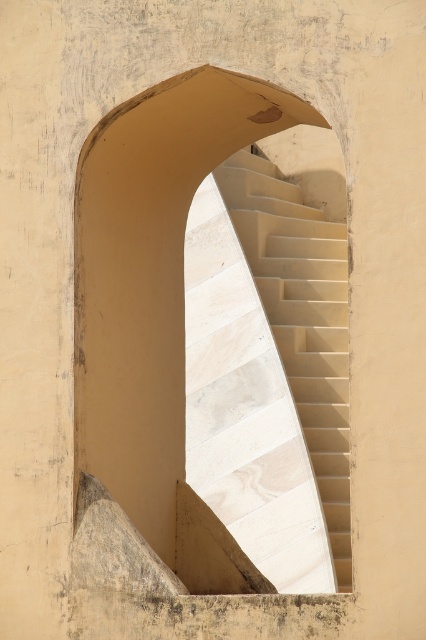
You are an architect designing a new building and want to ensure that the beige marble stairs at center are wider than the beige stone archway at center. Based on the image provided, will this design requirement be met?

The beige stone archway at center is wider than the beige marble stairs at center, so the design requirement for the stairs to be wider will not be met.

You are an architect designing a new building and want to ensure accessibility for wheelchairs. The minimum required distance between the beige stone archway at center and the beige marble stairs at center must be at least 1.5 meters for safety. Based on the image, does the current distance meet this requirement?

The beige stone archway at center is 2.48 meters away from the beige marble stairs at center, which exceeds the 1.5 meter requirement. Therefore, the current distance meets the accessibility requirement for wheelchair safety.

You are an architect designing a new building and want to incorporate a similar spiral staircase within an arched opening. The current design requires the distance between the beige stone archway at center and the nearest support beam to be at least 28 meters. Based on the image, will this requirement be met?

The distance between the beige stone archway at center and the nearest support beam is 27.96 meters, which is just 0.04 meters less than the required 28 meters. Therefore, the requirement will not be met.